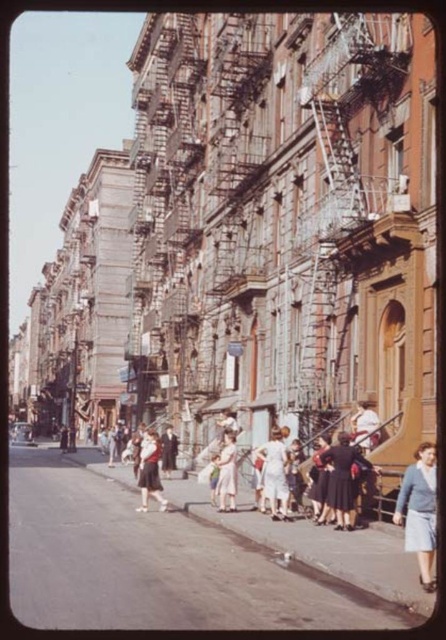
Is light blue fabric dress at lower right to the left of light pink dress at center from the viewer's perspective?

No, light blue fabric dress at lower right is not to the left of light pink dress at center.

Does point (417, 490) come farther from viewer compared to point (219, 470)?

No, it is in front of (219, 470).

Measure the distance between point (408, 512) and camera.

A distance of 48.03 meters exists between point (408, 512) and camera.

Image resolution: width=446 pixels, height=640 pixels. I want to click on light blue fabric dress at lower right, so click(x=420, y=512).

Does light blue fabric dress at lower right appear over matte black dress at center?

Yes, light blue fabric dress at lower right is above matte black dress at center.

How far apart are light blue fabric dress at lower right and matte black dress at center?

21.68 meters

What do you see at coordinates (420, 512) in the screenshot?
I see `light blue fabric dress at lower right` at bounding box center [420, 512].

The width and height of the screenshot is (446, 640). In order to click on light blue fabric dress at lower right in this screenshot , I will do `click(420, 512)`.

Does dark fabric dress at center lie in front of white cotton dress at center?

That is True.

Can you confirm if dark fabric dress at center is positioned above white cotton dress at center?

Correct, dark fabric dress at center is located above white cotton dress at center.

Is point (329, 499) positioned after point (275, 472)?

No.

The height and width of the screenshot is (640, 446). I want to click on dark fabric dress at center, so click(343, 477).